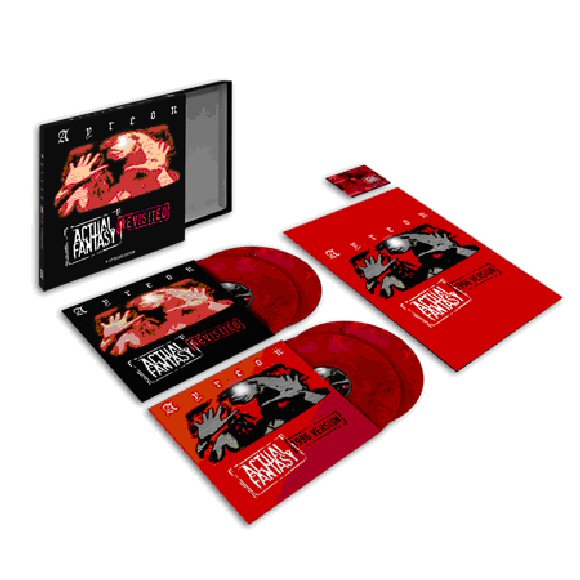
What are the coordinates of `dvd sleeve` in the screenshot? It's located at (332, 447), (235, 340).